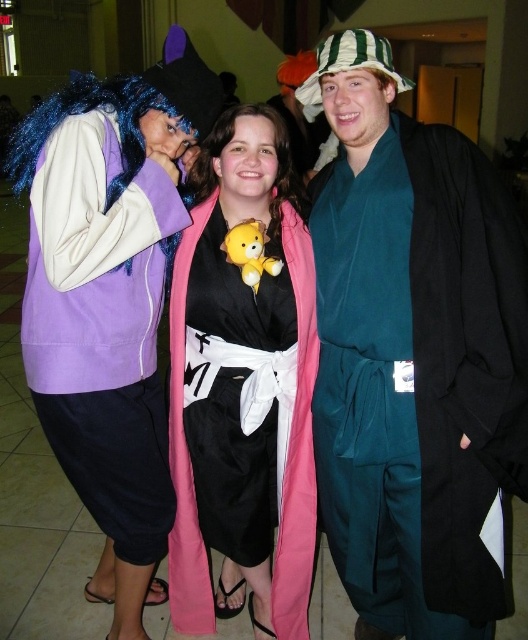
Can you confirm if teal silk kimono at center is thinner than purple matte jacket at left?

Yes, teal silk kimono at center is thinner than purple matte jacket at left.

Is teal silk kimono at center smaller than purple matte jacket at left?

Yes, teal silk kimono at center is smaller than purple matte jacket at left.

Measure the distance between point [428,497] and camera.

Point [428,497] and camera are 5.49 feet apart from each other.

The height and width of the screenshot is (640, 528). Identify the location of teal silk kimono at center. (413, 356).

Does purple matte jacket at left have a smaller size compared to pink fabric teddy bear at center?

No.

Who is more forward, (95, 236) or (188, 566)?

Point (95, 236) is more forward.

Describe the element at coordinates (109, 298) in the screenshot. I see `purple matte jacket at left` at that location.

Locate an element on the screen. The image size is (528, 640). purple matte jacket at left is located at coordinates (109, 298).

Looking at this image, is teal silk kimono at center wider than pink fabric teddy bear at center?

Correct, the width of teal silk kimono at center exceeds that of pink fabric teddy bear at center.

Is teal silk kimono at center taller than pink fabric teddy bear at center?

Yes, teal silk kimono at center is taller than pink fabric teddy bear at center.

Where is `teal silk kimono at center`? teal silk kimono at center is located at coordinates (413, 356).